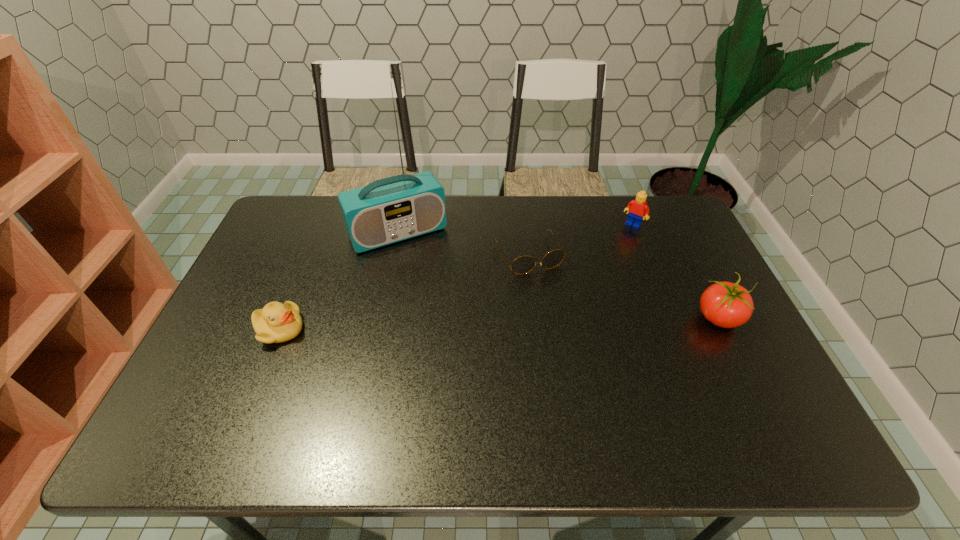
Where is `vacant space on the desktop that is between the duckling and the rightmost object and is positioned on the front panel of the second object from left to right`? This screenshot has height=540, width=960. vacant space on the desktop that is between the duckling and the rightmost object and is positioned on the front panel of the second object from left to right is located at coordinates (448, 325).

Where is `free space on the desktop that is between the fourth tallest object and the tomato and is positioned on the face of the fourth object from left to right`? The image size is (960, 540). free space on the desktop that is between the fourth tallest object and the tomato and is positioned on the face of the fourth object from left to right is located at coordinates (560, 322).

This screenshot has width=960, height=540. Find the location of `vacant space on the desktop that is between the leftmost object and the rightmost object and is positioned on the lenses of the third object from right to left`. vacant space on the desktop that is between the leftmost object and the rightmost object and is positioned on the lenses of the third object from right to left is located at coordinates (564, 322).